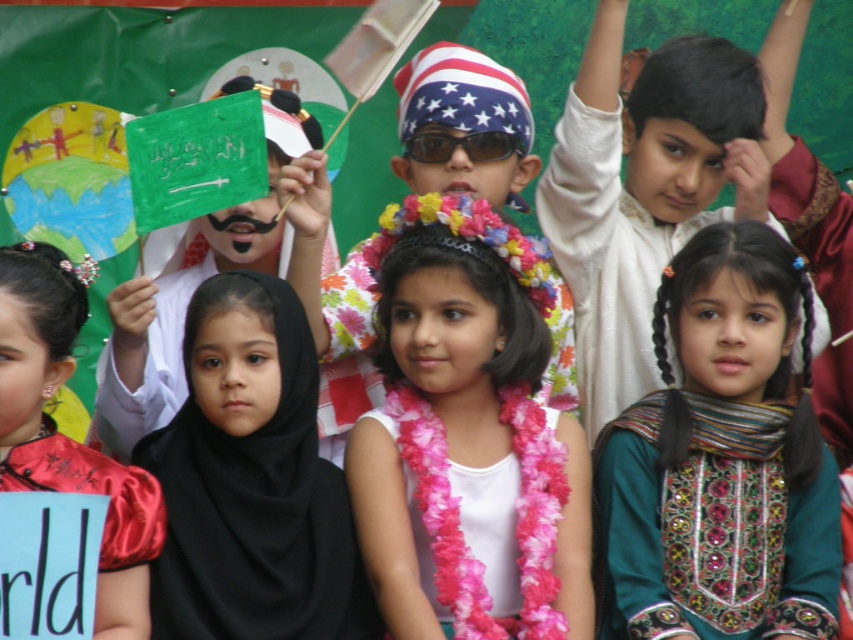
Question: Which object is farther from the camera taking this photo?

Choices:
 (A) red satin dress at left
 (B) black fabric hijab at center
 (C) reflective plastic sunglasses at center
 (D) pink fabric lei at center

Answer: (C)

Question: Is pink fabric lei at center to the left of black fabric hijab at center from the viewer's perspective?

Choices:
 (A) no
 (B) yes

Answer: (A)

Question: Which object is the farthest from the black fabric hijab at center?

Choices:
 (A) pink fabric lei at center
 (B) reflective plastic sunglasses at center

Answer: (B)

Question: Does pink fabric lei at center have a smaller size compared to black fabric hijab at center?

Choices:
 (A) yes
 (B) no

Answer: (A)

Question: Which of the following is the farthest from the observer?

Choices:
 (A) black fabric hijab at center
 (B) pink fabric lei at center
 (C) red satin dress at left

Answer: (B)

Question: Does pink fabric lei at center have a smaller size compared to reflective plastic sunglasses at center?

Choices:
 (A) yes
 (B) no

Answer: (A)